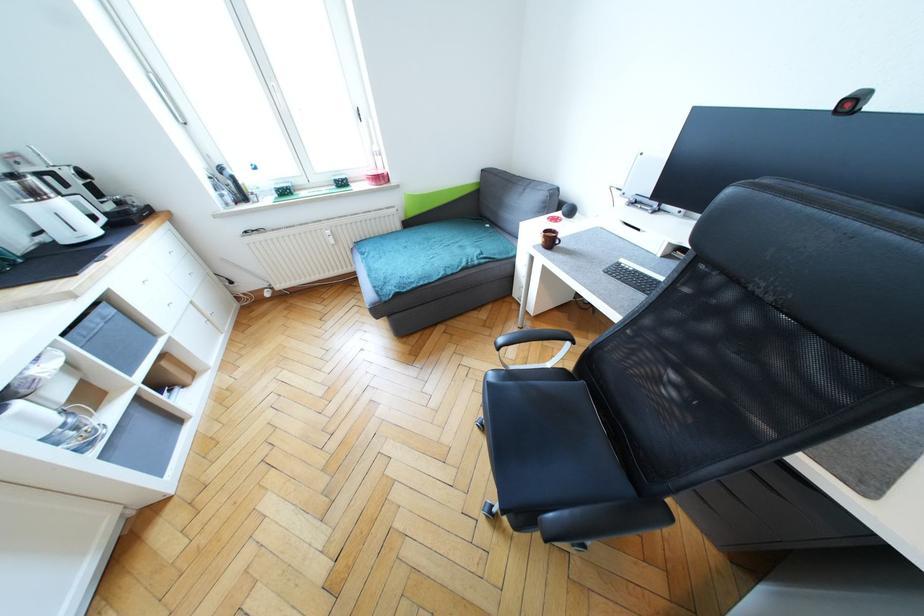
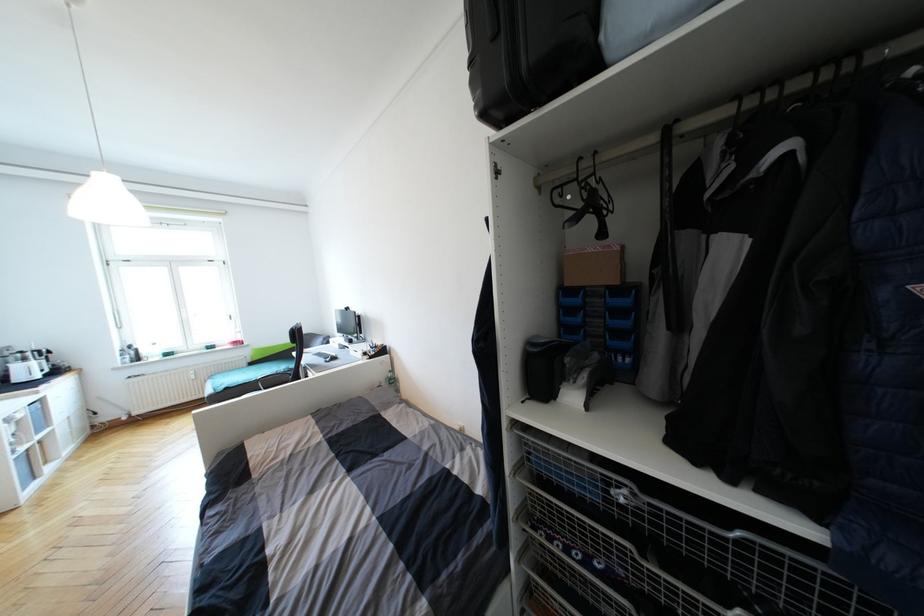
Question: I am providing you with two images of the same scene from different viewpoints. After the viewpoint changes to image2, which objects are now occluded?

Choices:
 (A) brown coffee mug
 (B) silver wall stop
 (C) chair sitting surface
 (D) window handle

Answer: (A)